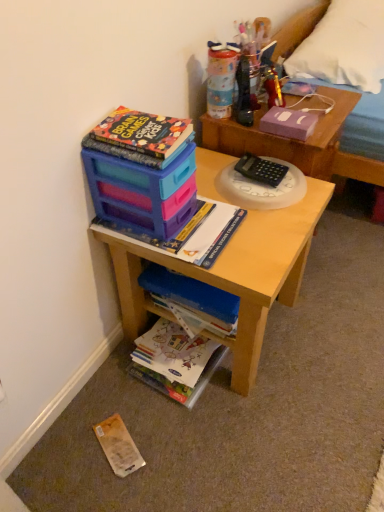
At what (x,y) coordinates should I click in order to perform the action: click on empty space that is ontop of matte plastic desk at center (from a real-world perspective). Please return your answer as a coordinate pair (x, y). The height and width of the screenshot is (512, 384). Looking at the image, I should click on (231, 210).